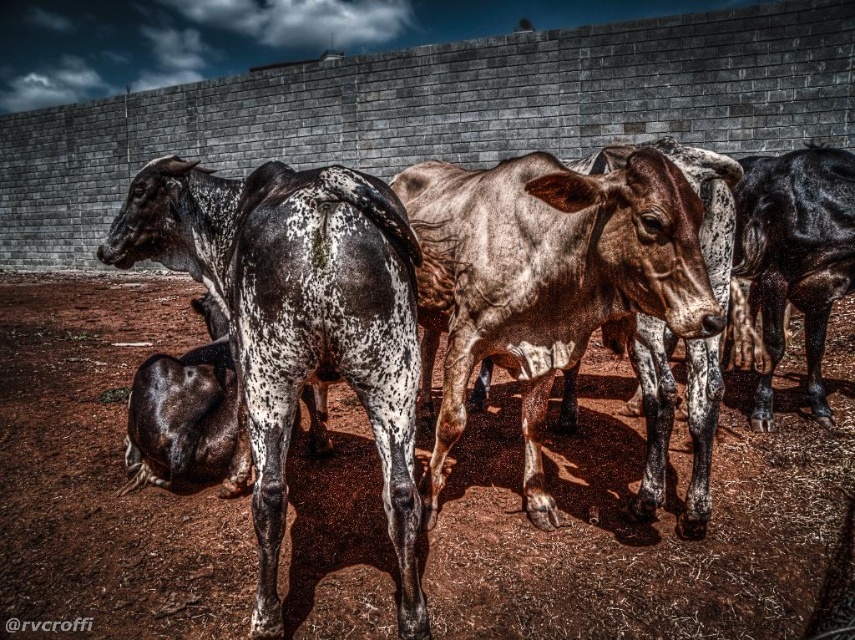
Does brown dirt field at center appear over black glossy bull at right?

No, brown dirt field at center is not above black glossy bull at right.

Who is more forward, (759, 483) or (761, 278)?

Point (759, 483) is in front.

Image resolution: width=855 pixels, height=640 pixels. I want to click on brown dirt field at center, so click(x=646, y=524).

Between point (578, 499) and point (331, 276), which one is positioned in front?

Point (331, 276) is in front.

Is point (351, 548) closer to viewer compared to point (370, 365)?

That is False.

The height and width of the screenshot is (640, 855). Identify the location of brown dirt field at center. (646, 524).

Can you confirm if speckled fur at center is shorter than black glossy bull at right?

Indeed, speckled fur at center has a lesser height compared to black glossy bull at right.

This screenshot has width=855, height=640. What do you see at coordinates (552, 275) in the screenshot?
I see `speckled fur at center` at bounding box center [552, 275].

At what (x,y) coordinates should I click in order to perform the action: click on speckled fur at center. Please return your answer as a coordinate pair (x, y). The height and width of the screenshot is (640, 855). Looking at the image, I should click on (552, 275).